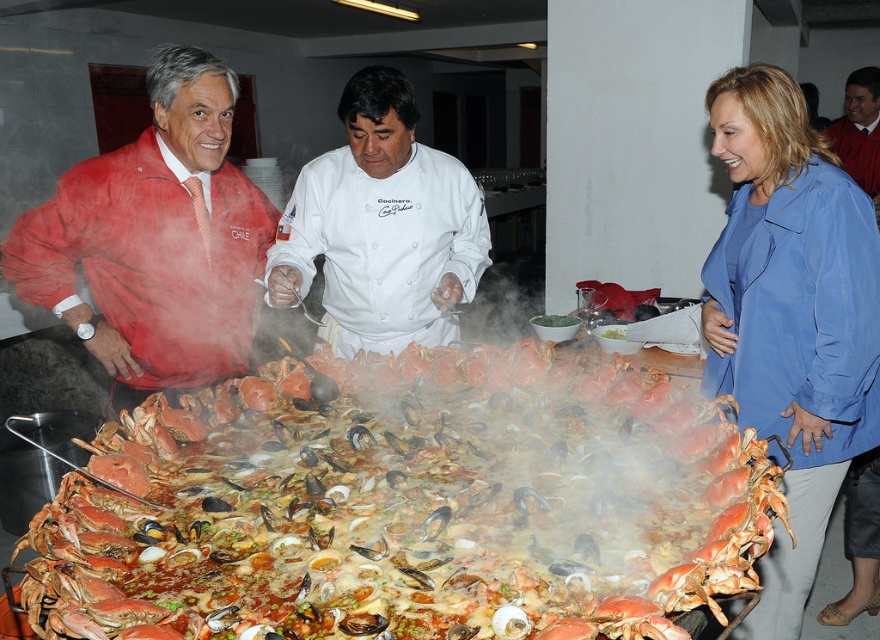
Question: Which is nearer to the smooth skin face at upper right?

Choices:
 (A) matte red jacket at left
 (B) blue fabric jacket at lower right
 (C) shiny orange crab at center

Answer: (B)

Question: Is shiny orange crab at center further to camera compared to blue fabric jacket at lower right?

Choices:
 (A) no
 (B) yes

Answer: (A)

Question: Observing the image, what is the correct spatial positioning of blue fabric jacket at lower right in reference to white chef coat at center?

Choices:
 (A) below
 (B) above

Answer: (A)

Question: Is the position of shiny orange crab at center less distant than that of blue fabric jacket at lower right?

Choices:
 (A) no
 (B) yes

Answer: (B)

Question: Among these points, which one is farthest from the camera?

Choices:
 (A) (319, 161)
 (B) (621, 632)

Answer: (A)

Question: Which of the following is the farthest from the observer?

Choices:
 (A) (594, 396)
 (B) (710, 333)
 (C) (876, 131)
 (D) (394, 227)

Answer: (C)